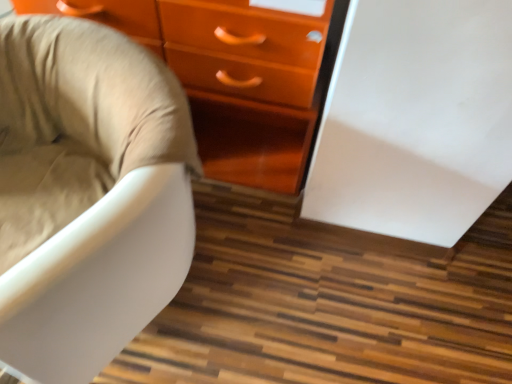
Measure the distance between point (9, 34) and camera.

The distance of point (9, 34) from camera is 37.44 inches.

Describe the element at coordinates (86, 189) in the screenshot. I see `beige fabric chair at left` at that location.

This screenshot has width=512, height=384. Find the location of `beige fabric chair at left`. beige fabric chair at left is located at coordinates (86, 189).

Image resolution: width=512 pixels, height=384 pixels. What do you see at coordinates (232, 76) in the screenshot? I see `glossy orange chest of drawers at center` at bounding box center [232, 76].

Where is `glossy orange chest of drawers at center`? The image size is (512, 384). glossy orange chest of drawers at center is located at coordinates (232, 76).

Where is `beige fabric chair at left`? Image resolution: width=512 pixels, height=384 pixels. beige fabric chair at left is located at coordinates (86, 189).

Which object is positioned more to the right, beige fabric chair at left or glossy orange chest of drawers at center?

From the viewer's perspective, glossy orange chest of drawers at center appears more on the right side.

Considering their positions, is beige fabric chair at left located in front of or behind glossy orange chest of drawers at center?

Clearly, beige fabric chair at left is in front of glossy orange chest of drawers at center.

Which point is more distant from viewer, (36, 146) or (331, 37)?

The point (36, 146) is farther from the camera.

From the image's perspective, between beige fabric chair at left and glossy orange chest of drawers at center, which one is located above?

glossy orange chest of drawers at center.

From a real-world perspective, is beige fabric chair at left above or below glossy orange chest of drawers at center?

Clearly, from a real-world perspective, beige fabric chair at left is below glossy orange chest of drawers at center.

Does beige fabric chair at left have a greater width compared to glossy orange chest of drawers at center?

Indeed, beige fabric chair at left has a greater width compared to glossy orange chest of drawers at center.

Considering the relative sizes of beige fabric chair at left and glossy orange chest of drawers at center in the image provided, is beige fabric chair at left shorter than glossy orange chest of drawers at center?

Yes.

Looking at the image, does beige fabric chair at left seem bigger or smaller compared to glossy orange chest of drawers at center?

Considering their sizes, beige fabric chair at left takes up less space than glossy orange chest of drawers at center.

Is beige fabric chair at left positioned beyond the bounds of glossy orange chest of drawers at center?

beige fabric chair at left is positioned outside glossy orange chest of drawers at center.

Is beige fabric chair at left directly adjacent to glossy orange chest of drawers at center?

They are not placed beside each other.

Could you tell me if beige fabric chair at left is turned towards glossy orange chest of drawers at center?

No.

What's the angular difference between beige fabric chair at left and glossy orange chest of drawers at center's facing directions?

27.7 degrees.

In order to click on chair on the left of the glossy orange chest of drawers at center in this screenshot , I will do `click(86, 189)`.

Which is more to the right, glossy orange chest of drawers at center or beige fabric chair at left?

From the viewer's perspective, glossy orange chest of drawers at center appears more on the right side.

Does glossy orange chest of drawers at center come in front of beige fabric chair at left?

That is False.

Considering the positions of points (170, 58) and (26, 342), is point (170, 58) closer to camera compared to point (26, 342)?

No, it is not.

From the image's perspective, is glossy orange chest of drawers at center located above or below beige fabric chair at left?

Clearly, from the image's perspective, glossy orange chest of drawers at center is above beige fabric chair at left.

From a real-world perspective, which object stands above the other?

glossy orange chest of drawers at center, from a real-world perspective.

In terms of width, does glossy orange chest of drawers at center look wider or thinner when compared to beige fabric chair at left?

Considering their sizes, glossy orange chest of drawers at center looks slimmer than beige fabric chair at left.

From their relative heights in the image, would you say glossy orange chest of drawers at center is taller or shorter than beige fabric chair at left?

glossy orange chest of drawers at center is taller than beige fabric chair at left.

Considering the relative sizes of glossy orange chest of drawers at center and beige fabric chair at left in the image provided, is glossy orange chest of drawers at center smaller than beige fabric chair at left?

Incorrect, glossy orange chest of drawers at center is not smaller in size than beige fabric chair at left.

Is glossy orange chest of drawers at center situated inside beige fabric chair at left or outside?

glossy orange chest of drawers at center cannot be found inside beige fabric chair at left.

Is glossy orange chest of drawers at center not near beige fabric chair at left?

glossy orange chest of drawers at center is actually quite close to beige fabric chair at left.

Is glossy orange chest of drawers at center turned away from beige fabric chair at left?

No.

Measure the distance from glossy orange chest of drawers at center to beige fabric chair at left.

15.00 inches.

Find the location of `chest of drawers that appears on the right of beige fabric chair at left`. chest of drawers that appears on the right of beige fabric chair at left is located at coordinates (232, 76).

In the image, there is a glossy orange chest of drawers at center. What are the coordinates of `chair below it (from a real-world perspective)` in the screenshot? It's located at (86, 189).

You are a GUI agent. You are given a task and a screenshot of the screen. Output one action in this format:
    pyautogui.click(x=<x>, y=<y>)
    Task: Click on the chest of drawers to the right of beige fabric chair at left
    
    Given the screenshot: What is the action you would take?
    pyautogui.click(x=232, y=76)